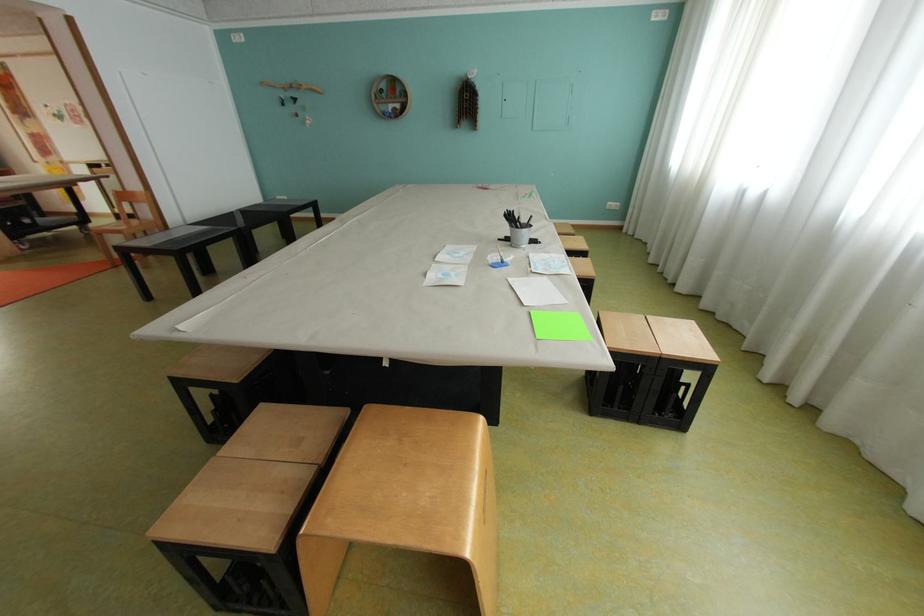
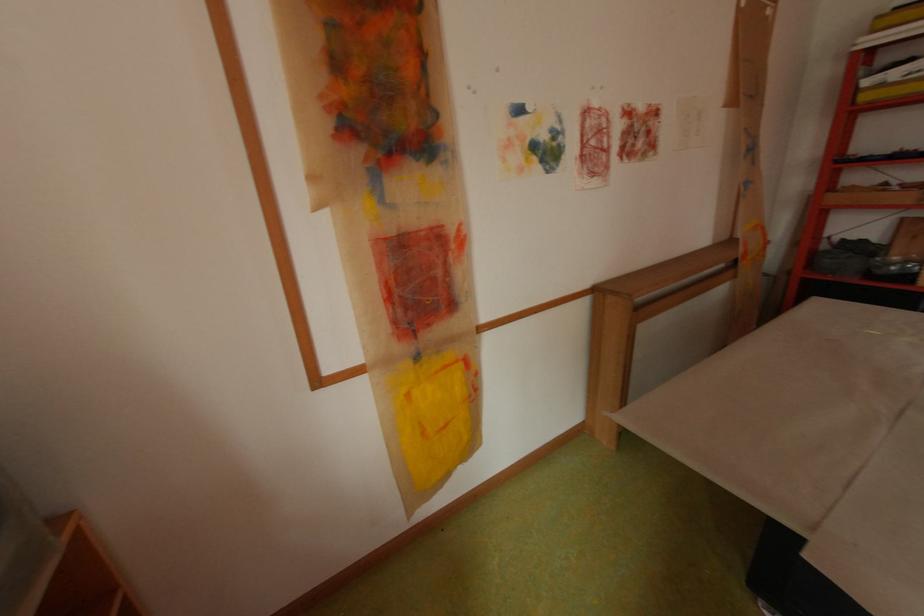
Find the pixel in the second image that matches point (58, 163) in the first image.

(429, 358)